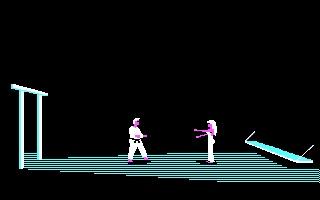
At what (x,y) coordinates should I click in order to perform the action: click on bench. Please return your answer as a coordinate pair (x, y). The height and width of the screenshot is (200, 320). Looking at the image, I should click on (286, 154).